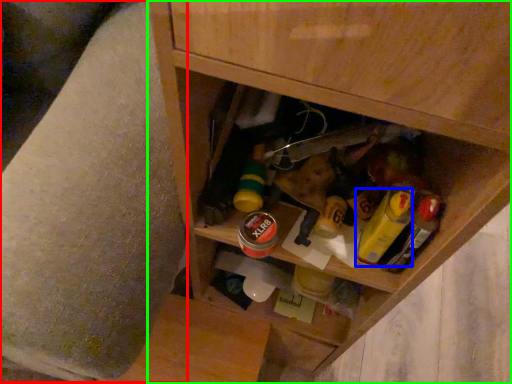
Question: Considering the real-world distances, which object is farthest from swivel chair (highlighted by a red box)? mustard (highlighted by a blue box) or cabinetry (highlighted by a green box)?

Choices:
 (A) mustard
 (B) cabinetry

Answer: (A)